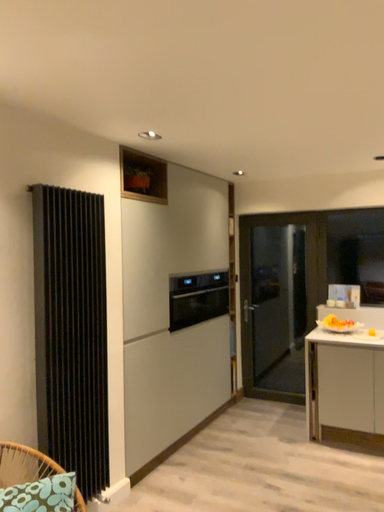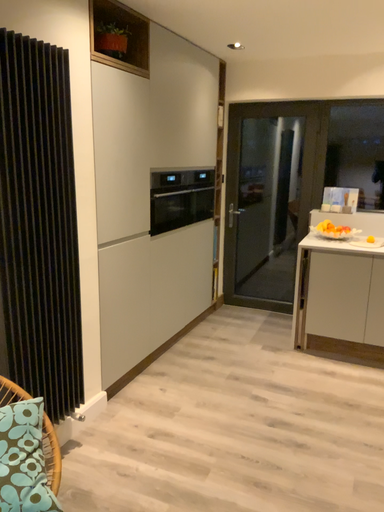
Question: Which way did the camera rotate in the video?

Choices:
 (A) rotated downward
 (B) rotated upward

Answer: (A)